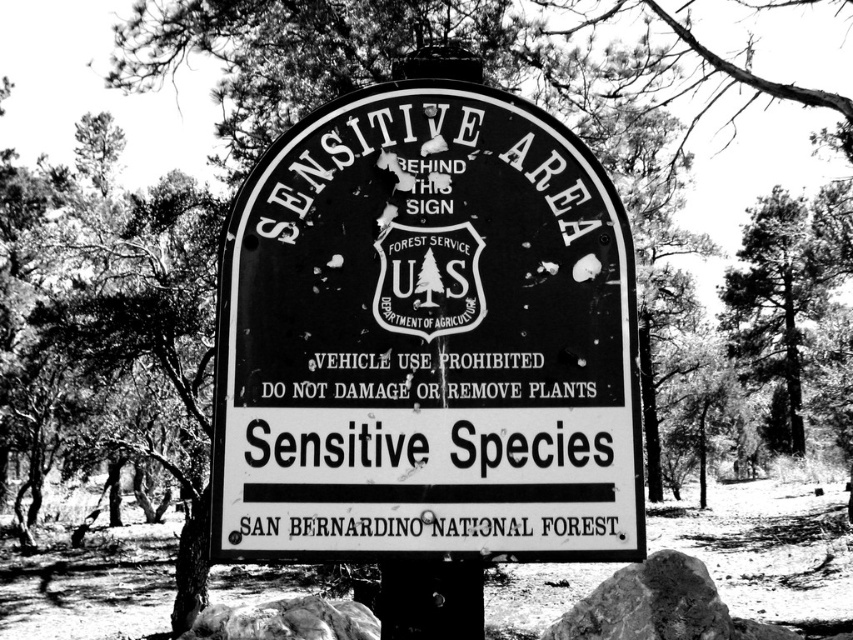
You are a hiker trying to determine the distance between two points marked on the sign. The points are labeled as point 1 at coordinates point (x=312, y=362) and point 2 at coordinates point (x=755, y=332). Given that point 1 is closer to the camera than point 2, can you estimate which point is higher on the sign?

Result: Point 1 at coordinates point (x=312, y=362) is closer to the camera than point 2, so it is higher on the sign.

You are standing in front of the sign and want to touch both points on the sign. Which point should you reach for first, the point at coordinates point (x=311, y=388) or point (x=252, y=525)?

You should reach for point (x=252, y=525) first because it is closer to you than point (x=311, y=388), which is further away.

Based on the photo, you are a hiker who just arrived at the San Bernardino National Forest and see the black metal sign at center and the dark green textured tree at right. Which object is positioned higher up in the image?

The dark green textured tree at right is positioned higher up in the image because the black metal sign at center is located below it.